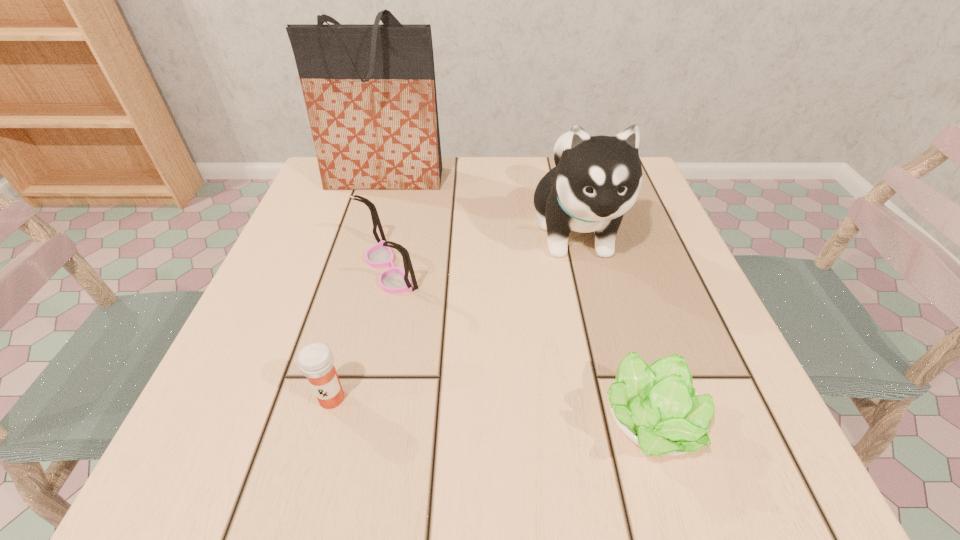
The width and height of the screenshot is (960, 540). I want to click on vacant space that satisfies the following two spatial constraints: 1. on the front-facing side of the shortest object; 2. on the right side of the tallest object, so click(x=314, y=424).